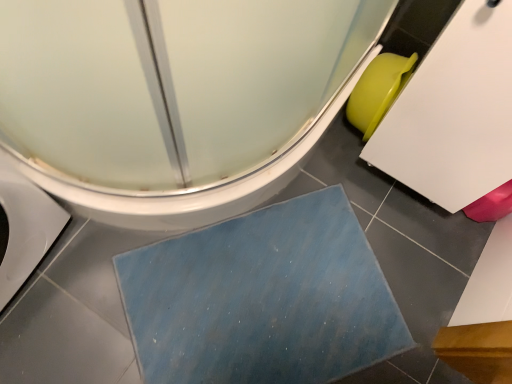
Question: Is green matte toilet bowl at right facing away from white glossy toilet at lower left?

Choices:
 (A) no
 (B) yes

Answer: (A)

Question: Can you confirm if green matte toilet bowl at right is smaller than white glossy toilet at lower left?

Choices:
 (A) no
 (B) yes

Answer: (B)

Question: Is green matte toilet bowl at right oriented towards white glossy toilet at lower left?

Choices:
 (A) yes
 (B) no

Answer: (B)

Question: Considering the relative sizes of green matte toilet bowl at right and white glossy toilet at lower left in the image provided, is green matte toilet bowl at right shorter than white glossy toilet at lower left?

Choices:
 (A) yes
 (B) no

Answer: (B)

Question: Considering the relative positions of green matte toilet bowl at right and white glossy toilet at lower left in the image provided, is green matte toilet bowl at right to the right of white glossy toilet at lower left from the viewer's perspective?

Choices:
 (A) no
 (B) yes

Answer: (B)

Question: Is green matte toilet bowl at right positioned in front of white glossy toilet at lower left?

Choices:
 (A) no
 (B) yes

Answer: (A)

Question: Can you confirm if white glossy toilet at lower left is shorter than green matte toilet bowl at right?

Choices:
 (A) no
 (B) yes

Answer: (B)

Question: Does white glossy toilet at lower left appear on the left side of green matte toilet bowl at right?

Choices:
 (A) no
 (B) yes

Answer: (B)

Question: Is green matte toilet bowl at right completely or partially inside white glossy toilet at lower left?

Choices:
 (A) no
 (B) yes

Answer: (A)

Question: Is white glossy toilet at lower left thinner than green matte toilet bowl at right?

Choices:
 (A) no
 (B) yes

Answer: (A)

Question: Is white glossy toilet at lower left not within green matte toilet bowl at right?

Choices:
 (A) no
 (B) yes

Answer: (B)

Question: From the image's perspective, is white glossy toilet at lower left above green matte toilet bowl at right?

Choices:
 (A) no
 (B) yes

Answer: (B)

Question: Can you confirm if blue textured bath mat at lower center is thinner than green matte toilet bowl at right?

Choices:
 (A) no
 (B) yes

Answer: (A)